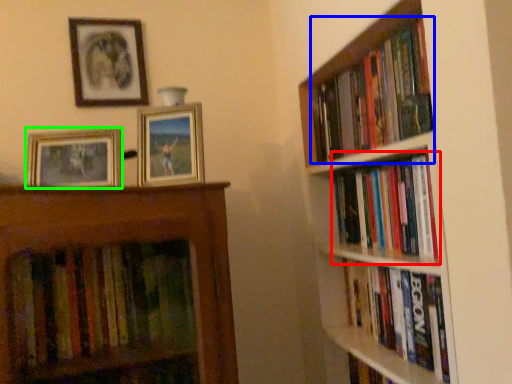
Question: Estimate the real-world distances between objects in this image. Which object is closer to book (highlighted by a red box), book (highlighted by a blue box) or picture frame (highlighted by a green box)?

Choices:
 (A) book
 (B) picture frame

Answer: (A)